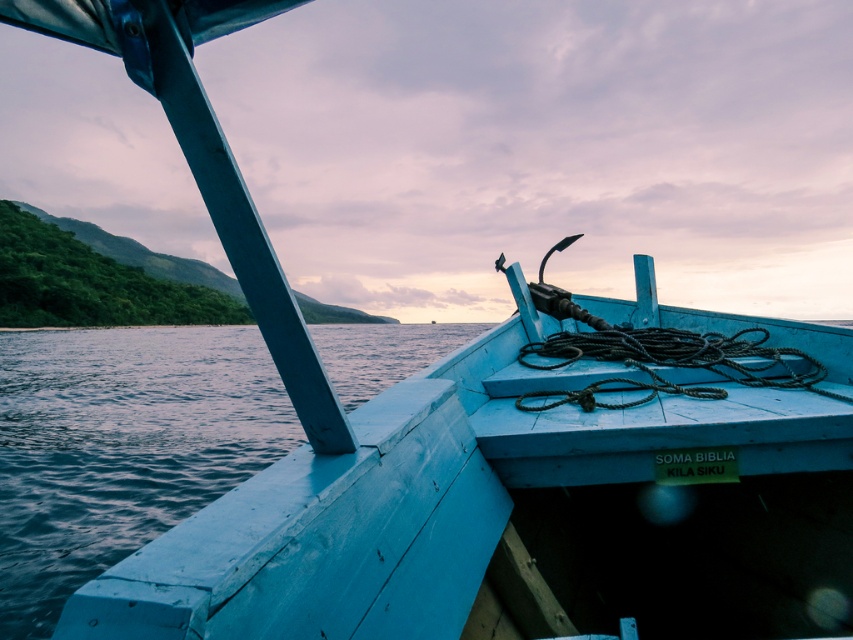
You are an observer sitting in the boat and want to know if the blue wooden water at lower left is higher than the black rope at center. Can you confirm this based on the scene?

The blue wooden water at lower left is taller than the black rope at center, so yes, the blue wooden water at lower left is higher than the black rope at center.

You are an observer sitting in the boat. You notice the blue wooden water at lower left and the black rope at center. Which object is closer to you?

The blue wooden water at lower left is closer to you because it is in front of the black rope at center.